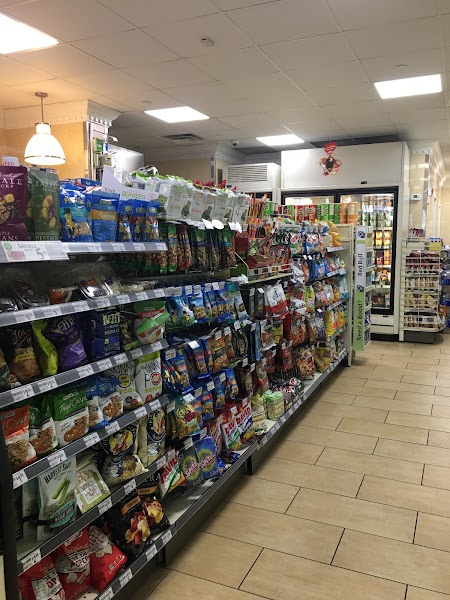
At what (x,y) coordinates should I click in order to perform the action: click on floor tiles. Please return your answer as a coordinate pair (x, y). The height and width of the screenshot is (600, 450). Looking at the image, I should click on (275, 577), (323, 480), (371, 408).